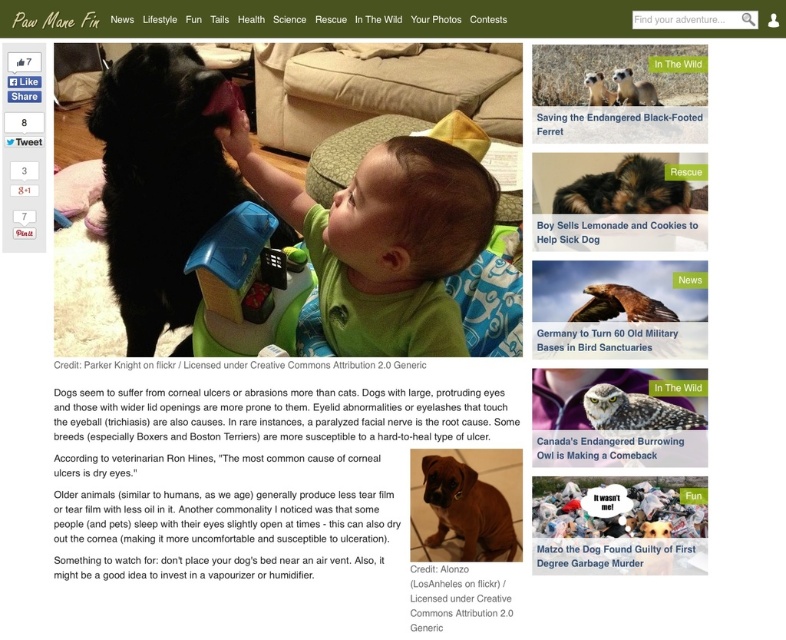
Question: From the image, what is the correct spatial relationship of green fabric baby at center in relation to brown matte hair at center?

Choices:
 (A) left
 (B) right

Answer: (A)

Question: Is the position of brown furry dog at center more distant than that of soft brown fur at center?

Choices:
 (A) yes
 (B) no

Answer: (A)

Question: Estimate the real-world distances between objects in this image. Which object is farther from the brown matte hair at center?

Choices:
 (A) soft brown fur at center
 (B) black matte dog at center
 (C) golden brown feathers at center

Answer: (B)

Question: Is brown furry dog at center positioned in front of soft brown fur at center?

Choices:
 (A) yes
 (B) no

Answer: (B)

Question: Which is nearer to the brown matte hair at center?

Choices:
 (A) furry black ferret at upper center
 (B) matte brown owl at upper right
 (C) black matte dog at center
 (D) brown furry dog at center

Answer: (A)

Question: Which object is closer to the camera taking this photo?

Choices:
 (A) black matte dog at center
 (B) matte brown owl at upper right

Answer: (B)